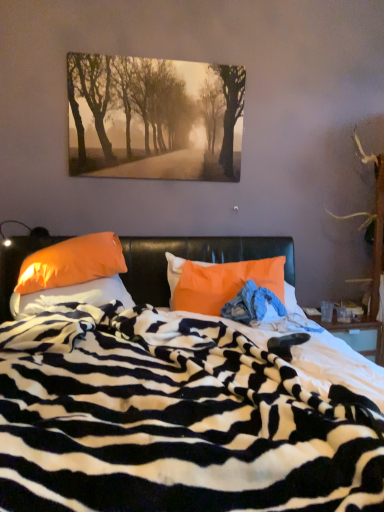
Locate an element on the screen. empty space that is ontop of matte paper print at upper center is located at coordinates (168, 55).